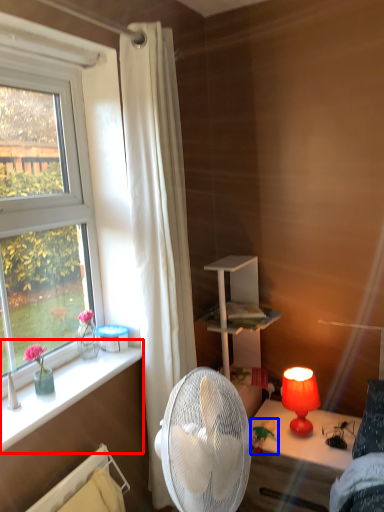
Question: Which object appears closest to the camera in this image, window sill (highlighted by a red box) or toy (highlighted by a blue box)?

Choices:
 (A) window sill
 (B) toy

Answer: (A)